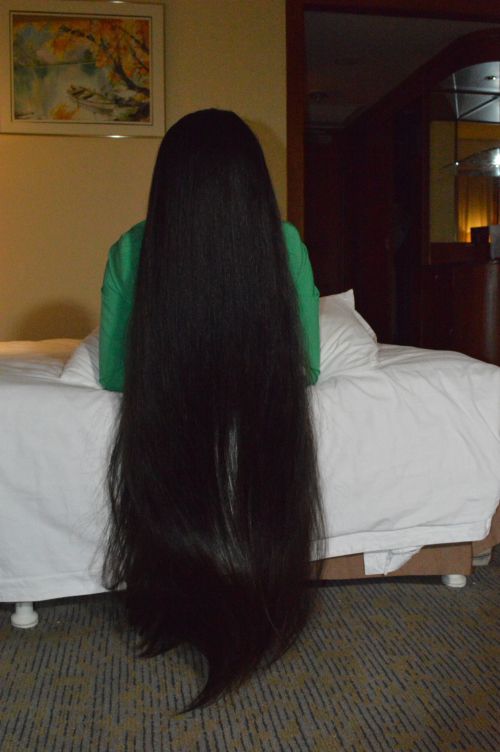
The width and height of the screenshot is (500, 752). I want to click on wall, so (204, 74).